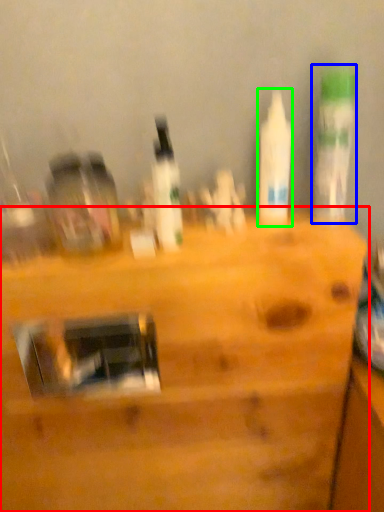
Question: Considering the real-world distances, which object is closest to furniture (highlighted by a red box)? bottle (highlighted by a blue box) or bottle (highlighted by a green box).

Choices:
 (A) bottle
 (B) bottle

Answer: (B)